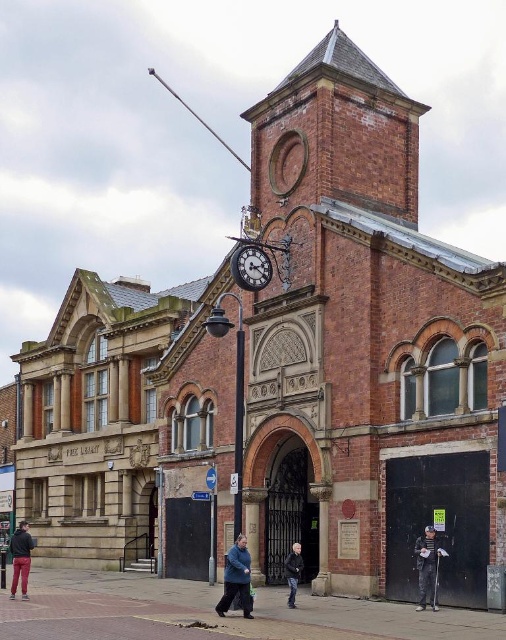
Who is lower down, matte black jacket at lower left or dark blue jacket at center?

matte black jacket at lower left

Find the location of a particular element. matte black jacket at lower left is located at coordinates (21, 557).

Identify the location of matte black jacket at lower left. (21, 557).

Which is more to the right, dark gray fabric jacket at lower right or matte black jacket at lower left?

Positioned to the right is dark gray fabric jacket at lower right.

Who is higher up, dark gray fabric jacket at lower right or matte black jacket at lower left?

dark gray fabric jacket at lower right is above.

Identify the location of dark gray fabric jacket at lower right. (428, 566).

Where is `dark gray fabric jacket at lower right`? dark gray fabric jacket at lower right is located at coordinates (428, 566).

Which is above, polished brass clock at center or matte black jacket at lower left?

polished brass clock at center

Is polished brass clock at center taller than matte black jacket at lower left?

No, polished brass clock at center is not taller than matte black jacket at lower left.

Which is behind, point (266, 276) or point (26, 536)?

Point (266, 276)

Locate an element on the screen. polished brass clock at center is located at coordinates (250, 266).